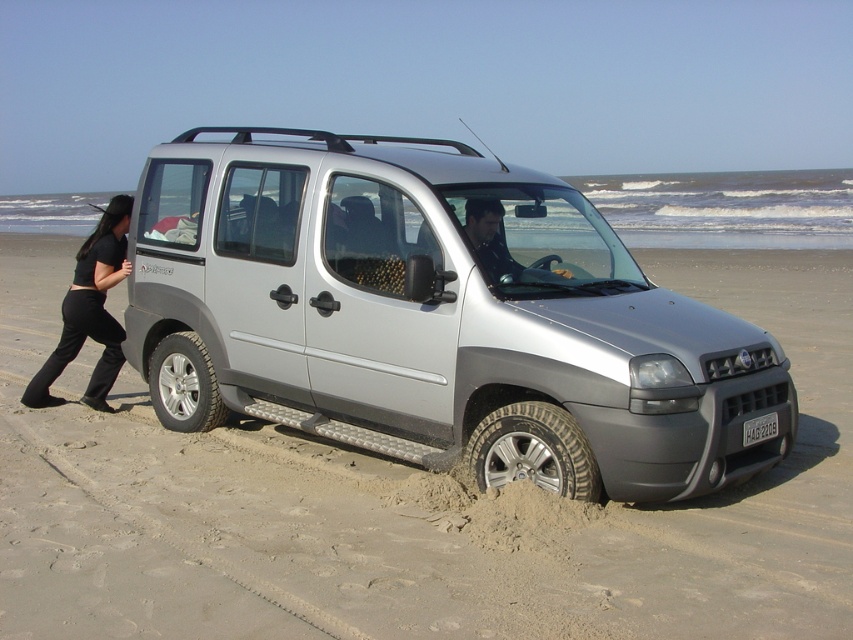
How distant is sandy gray beach at center from silver metallic tire at lower left?

sandy gray beach at center and silver metallic tire at lower left are 1.24 meters apart.

Who is positioned more to the left, sandy gray beach at center or silver metallic tire at lower left?

silver metallic tire at lower left is more to the left.

You are a GUI agent. You are given a task and a screenshot of the screen. Output one action in this format:
    pyautogui.click(x=<x>, y=<y>)
    Task: Click on the sandy gray beach at center
    The image size is (853, 640).
    Given the screenshot: What is the action you would take?
    pyautogui.click(x=410, y=506)

This screenshot has width=853, height=640. I want to click on sandy gray beach at center, so click(x=410, y=506).

Does point (125, 268) come behind point (511, 474)?

Yes, it is behind point (511, 474).

Which is in front, point (79, 259) or point (523, 468)?

Point (523, 468) is more forward.

Who is more forward, [115,342] or [544,484]?

Positioned in front is point [544,484].

The width and height of the screenshot is (853, 640). Identify the location of black cotton pants at left. click(90, 310).

Is silver metallic tire at lower center wider than silver metallic tire at lower left?

No.

Who is higher up, silver metallic tire at lower center or silver metallic tire at lower left?

silver metallic tire at lower left is higher up.

Locate an element on the screen. The width and height of the screenshot is (853, 640). silver metallic tire at lower center is located at coordinates (532, 451).

Identify the location of silver metallic tire at lower center. Image resolution: width=853 pixels, height=640 pixels. (532, 451).